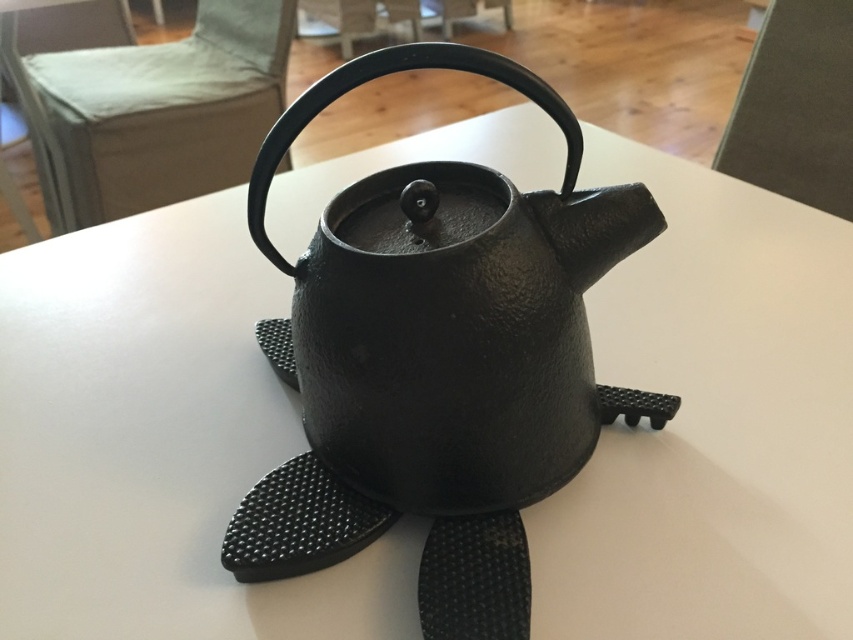
You are arranging items on a shelf and have two teapots in front of you. You need to place the matte black teapot at center and the black cast iron teapot at center side by side. Which one should you place first to ensure they fit properly?

The matte black teapot at center is wider than the black cast iron teapot at center. Therefore, you should place the matte black teapot at center first to accommodate its larger width, ensuring both teapots fit side by side.

You are arranging items on a kitchen counter and notice two black teapots. According to the image, where is the matte black teapot at center in relation to the black cast iron teapot at center?

The matte black teapot at center is to the right of the black cast iron teapot at center.